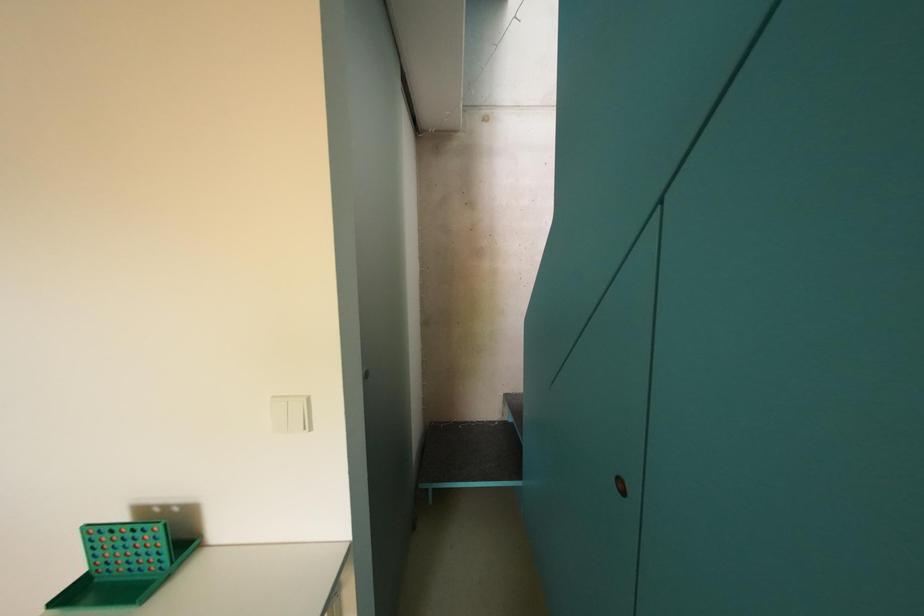
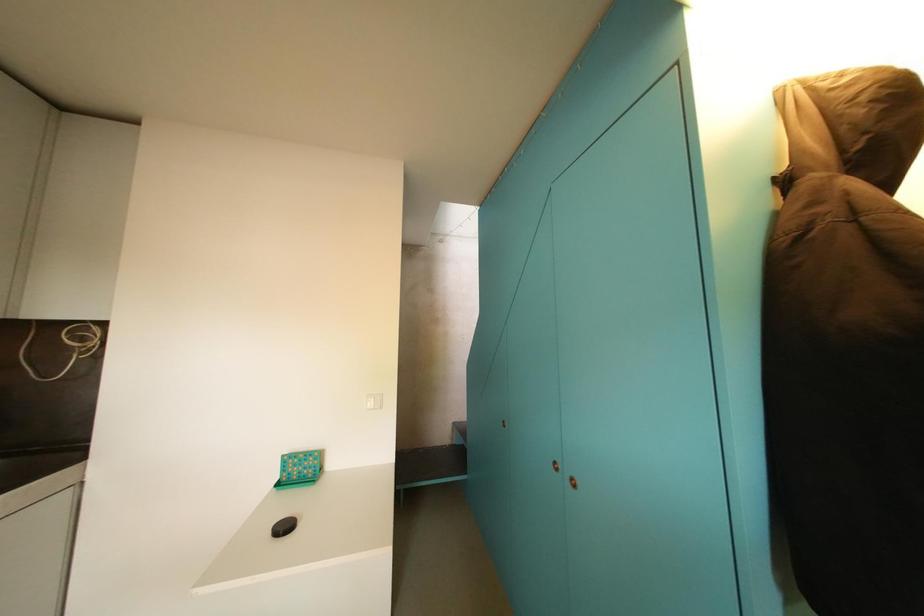
Question: The first image is from the beginning of the video and the second image is from the end. How did the camera likely rotate when shooting the video?

Choices:
 (A) Left
 (B) Right
 (C) Up
 (D) Down

Answer: (B)